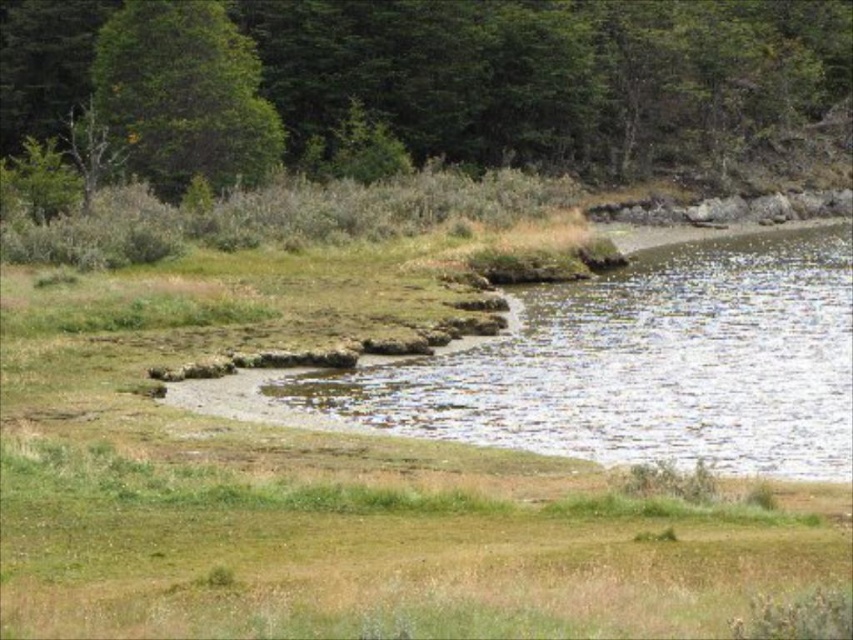
You are standing in the middle of the grassy area and want to walk towards the water. Which direction should you go to avoid the dry grass? The green leafy tree at upper center and the green leafy tree at upper left are in your view. Use their positions to determine the direction.

To avoid the dry grass, you should head towards the direction between the green leafy tree at upper center and the green leafy tree at upper left. Since the green leafy tree at upper center is to the right of the green leafy tree at upper left, the area between them likely has healthier grass leading towards the water.

You are standing at the water edge in the scene and want to walk towards the point labeled as point (682, 310). There is another point, point (697, 138), in your path. Which point will you reach first?

You will reach point (682, 310) first because it is closer to you than point (697, 138), which is further away.